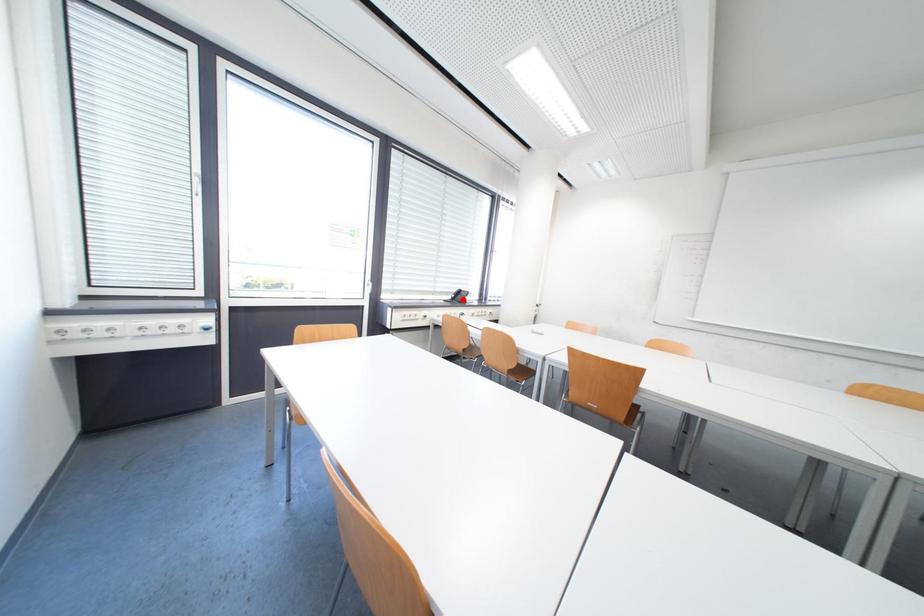
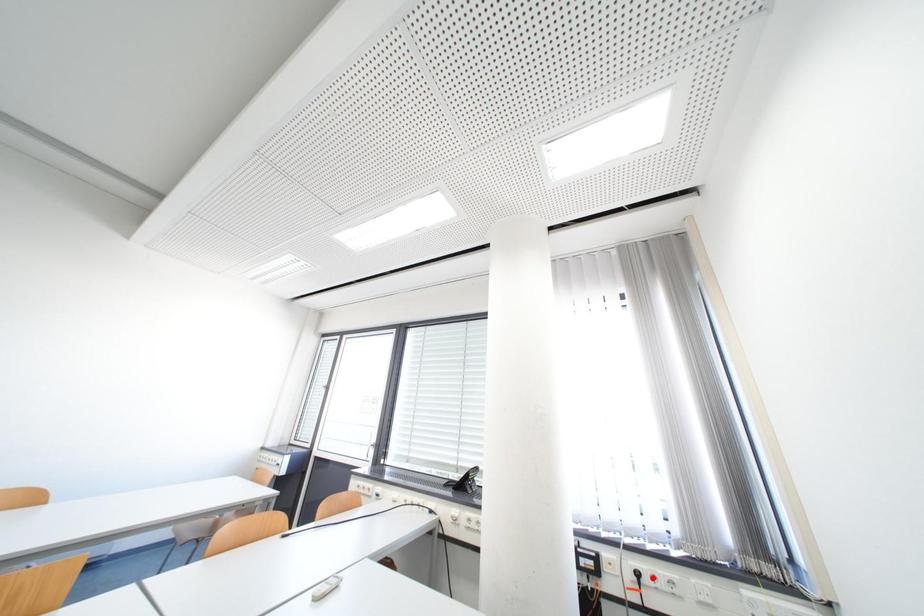
I am providing you with two images of the same scene from different viewpoints. A red point is marked on the first image and another point is marked on the second image. Are the points marked in image1 and image2 representing the same 3D position?

No